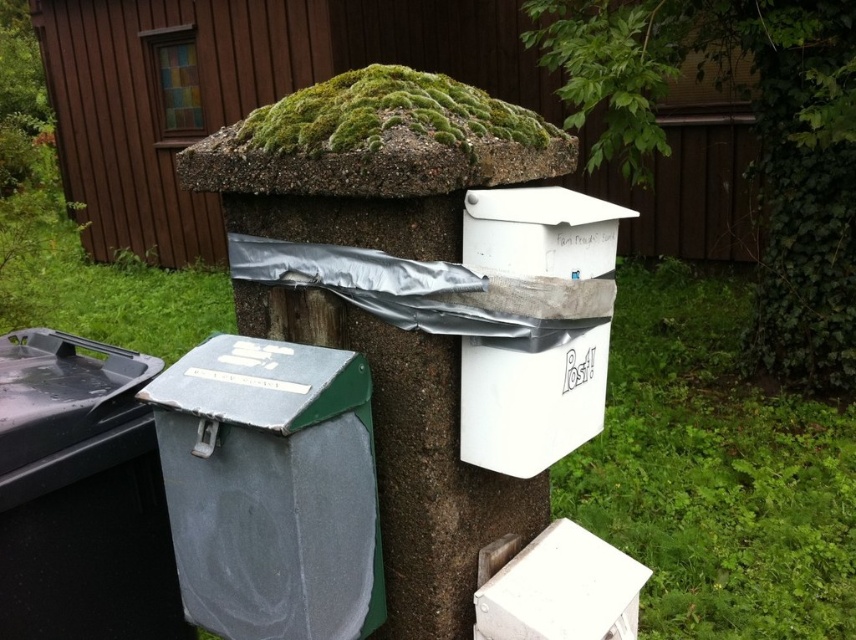
You are a delivery person who needs to place a large package in the area. The package is 2 meters long. There is a green mossy tree at upper center and a metallic gray recycling bin at lower left. Can you fit the package horizontally between them without bending it?

The distance between the green mossy tree at upper center and the metallic gray recycling bin at lower left is 2.32 meters, so yes, the package can be placed horizontally between them as the space is sufficient.

You are standing in front of the mailboxes and want to take a photo of the green mossy tree at upper center. What are the coordinates of the tree to ensure accurate framing?

The green mossy tree at upper center is located at coordinates 0.214 on the x axis and 0.887 on the y axis.